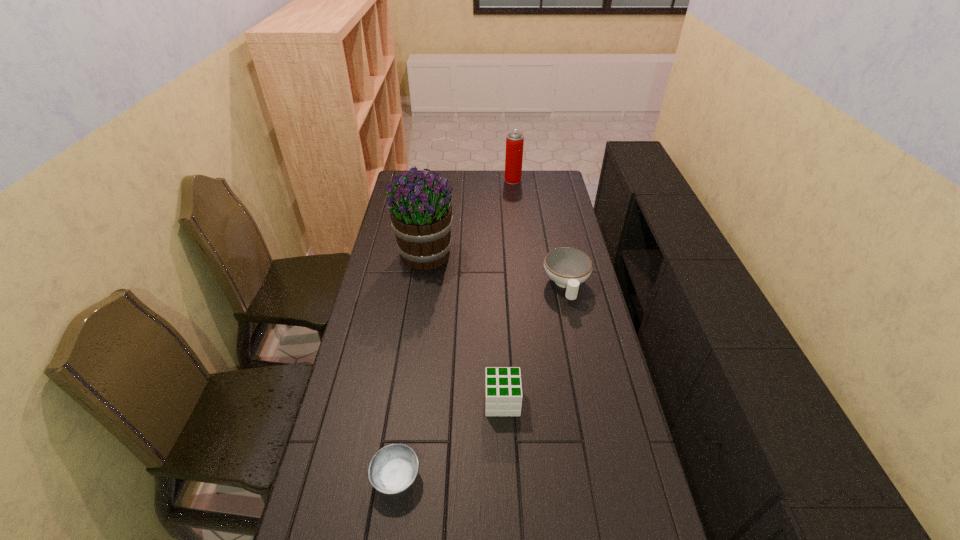
You are a GUI agent. You are given a task and a screenshot of the screen. Output one action in this format:
    pyautogui.click(x=<x>, y=<y>)
    Task: Click on the vacant point located 0.120m on the red face of the cube
    This screenshot has width=960, height=540.
    Given the screenshot: What is the action you would take?
    pyautogui.click(x=445, y=401)

The height and width of the screenshot is (540, 960). What are the coordinates of `vacant space located on the red face of the cube` in the screenshot? It's located at (459, 401).

Where is `vacant area situated 0.300m on the red face of the cube`? The image size is (960, 540). vacant area situated 0.300m on the red face of the cube is located at coordinates (386, 401).

Locate an element on the screen. The width and height of the screenshot is (960, 540). vacant region located on the side with the handle of the chinaware is located at coordinates (584, 369).

You are a GUI agent. You are given a task and a screenshot of the screen. Output one action in this format:
    pyautogui.click(x=<x>, y=<y>)
    Task: Click on the vacant space situated 0.140m on the left of the shortest object
    This screenshot has height=540, width=960.
    Given the screenshot: What is the action you would take?
    pyautogui.click(x=319, y=477)

Find the location of a particular element. The width and height of the screenshot is (960, 540). object that is at the far edge is located at coordinates (514, 141).

Where is `bouquet at the left edge`? The height and width of the screenshot is (540, 960). bouquet at the left edge is located at coordinates (421, 216).

Locate an element on the screen. ashtray located at the left edge is located at coordinates (393, 468).

The image size is (960, 540). I want to click on object that is at the right edge, so click(x=568, y=267).

In the image, there is a desktop. Find the location of `vacant space at the far edge`. vacant space at the far edge is located at coordinates tap(502, 193).